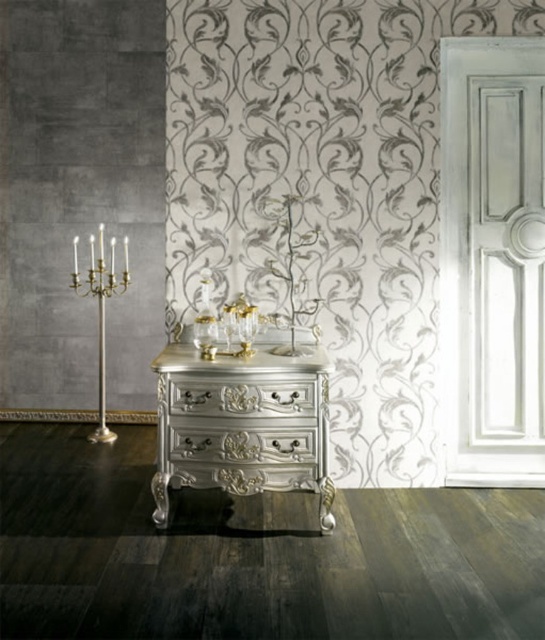
You are an interior designer planning to place a new decorative item between the silver polished wood vanity at center and the gold polished brass candle holder at left. Considering their widths, which object should you position closer to the wall to ensure the decorative item fits comfortably?

The silver polished wood vanity at center is wider than the gold polished brass candle holder at left. To ensure the decorative item fits comfortably, position the wider vanity closer to the wall so there is more space between them for the new item.

You are an interior designer arranging items in the room. You have a silver polished wood drawer at center and a gold polished brass candle holder at left. Which item takes up more space in the room?

The gold polished brass candle holder at left takes up more space in the room because it is larger than the silver polished wood drawer at center.